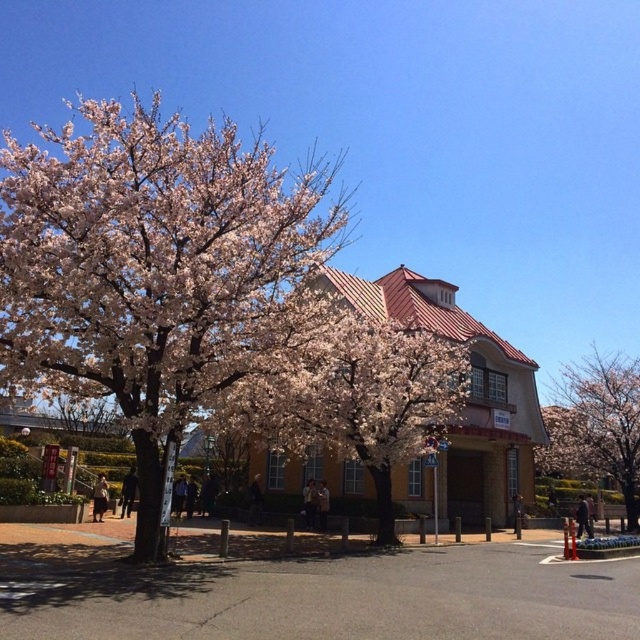
Question: Which point is closer to the camera taking this photo?

Choices:
 (A) (228, 296)
 (B) (582, 371)

Answer: (A)

Question: Which point appears closest to the camera in this image?

Choices:
 (A) (548, 406)
 (B) (163, 280)

Answer: (B)

Question: Which point appears closest to the camera in this image?

Choices:
 (A) (602, 442)
 (B) (300, 198)

Answer: (B)

Question: Does peachy-pink blossoms at upper left have a greater width compared to pink blossom tree at center?

Choices:
 (A) no
 (B) yes

Answer: (B)

Question: Is peachy-pink blossoms at upper left wider than pink blossom tree at center?

Choices:
 (A) no
 (B) yes

Answer: (B)

Question: In this image, where is peachy-pink blossoms at upper left located relative to pink blossom tree at center?

Choices:
 (A) left
 (B) right

Answer: (A)